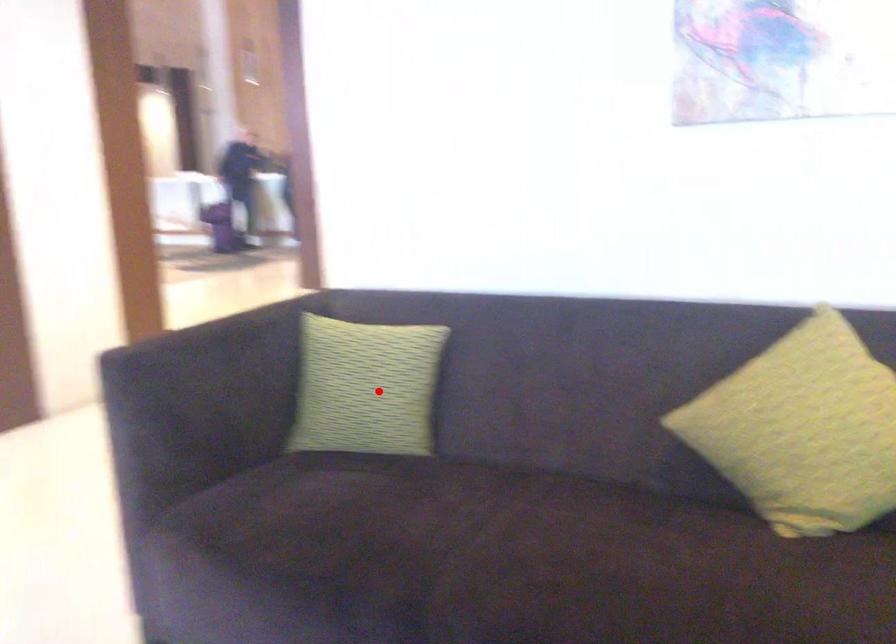
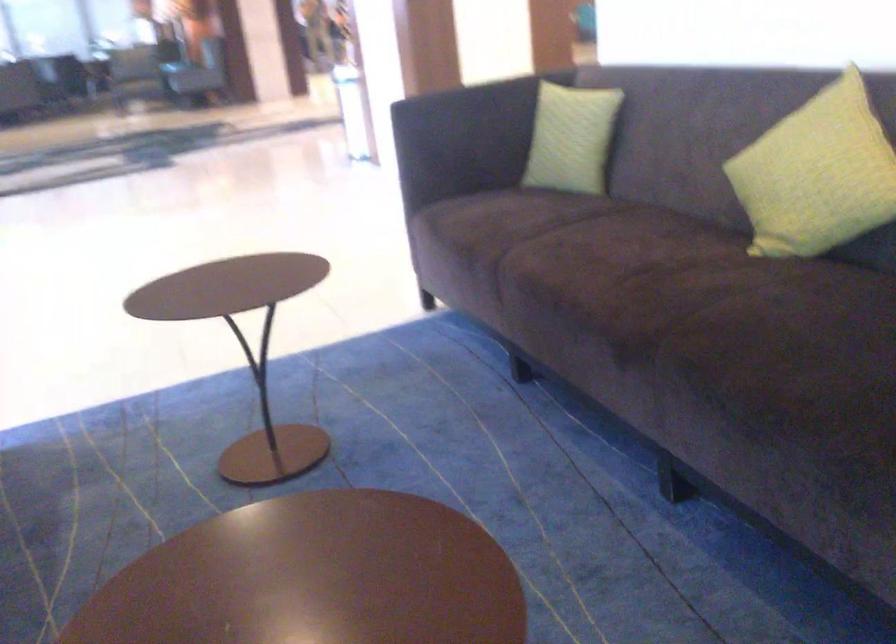
In the second image, find the point that corresponds to the highlighted location in the first image.

(571, 138)